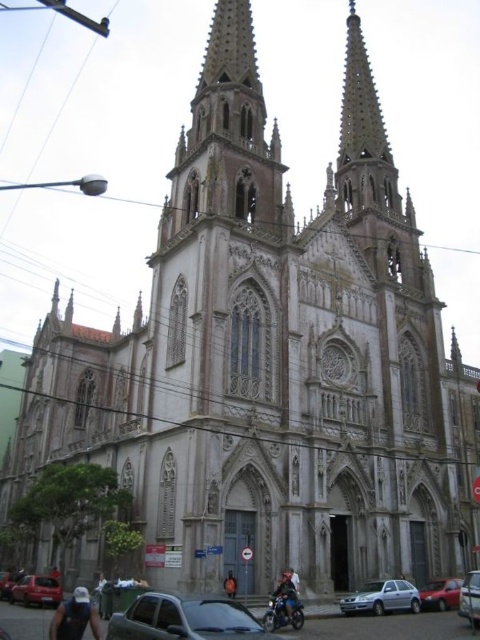
Question: Does matte black car at lower center appear on the right side of orange fabric jacket at center?

Choices:
 (A) yes
 (B) no

Answer: (B)

Question: Does denim jacket at lower left appear over matte red car at lower left?

Choices:
 (A) no
 (B) yes

Answer: (B)

Question: Based on their relative distances, which object is nearer to the metallic silver car at lower right?

Choices:
 (A) denim jacket at lower left
 (B) blue denim jeans at lower center
 (C) matte red car at lower left
 (D) silver metallic hatchback at lower center

Answer: (D)

Question: Which point is farther to the camera?

Choices:
 (A) metallic silver car at lower right
 (B) shiny black motorcycle at lower center
 (C) blue denim jeans at lower center

Answer: (A)

Question: Is silver metallic hatchback at lower center thinner than metallic silver car at center?

Choices:
 (A) no
 (B) yes

Answer: (A)

Question: Which of the following is the farthest from the observer?

Choices:
 (A) (231, 584)
 (B) (402, 595)
 (C) (297, 612)
 (D) (474, 582)

Answer: (B)